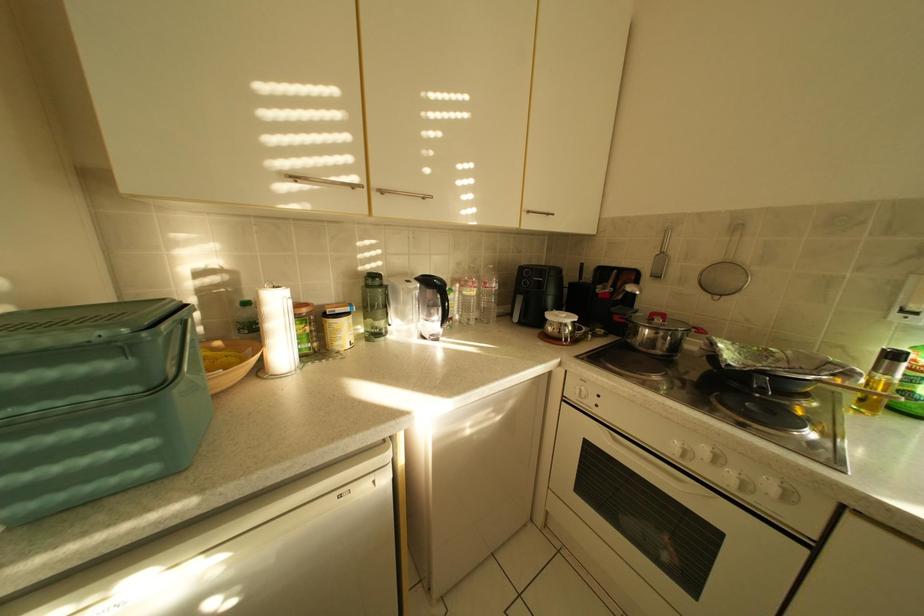
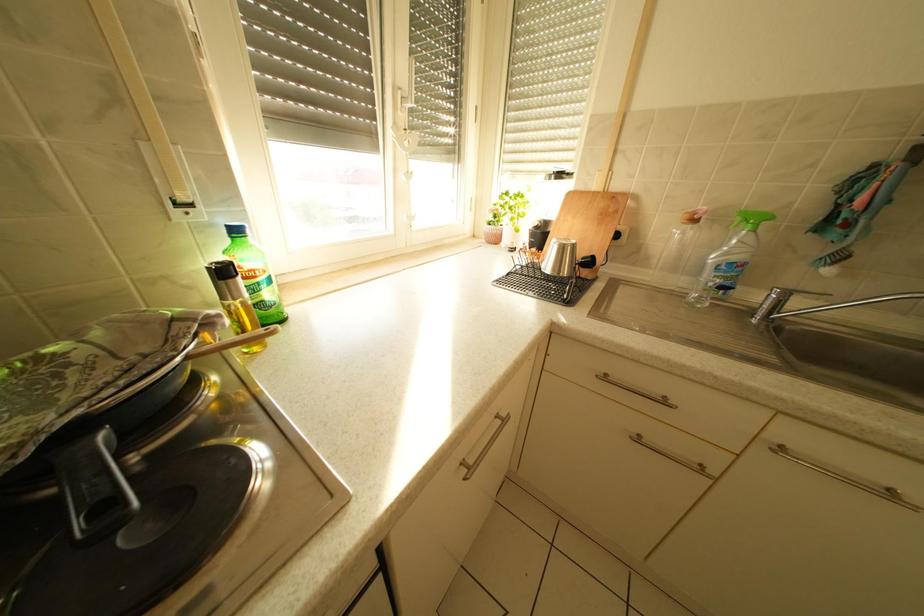
The images are taken continuously from a first-person perspective. In which direction is your viewpoint rotating?

The rotation direction of the camera is right-down.